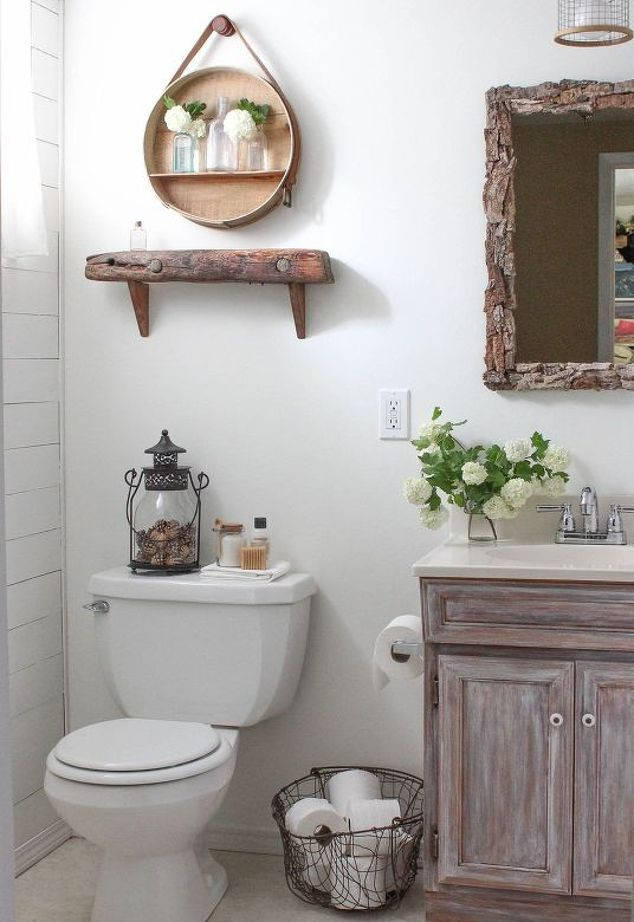
This screenshot has height=922, width=634. I want to click on top of toliet, so (x=132, y=726).